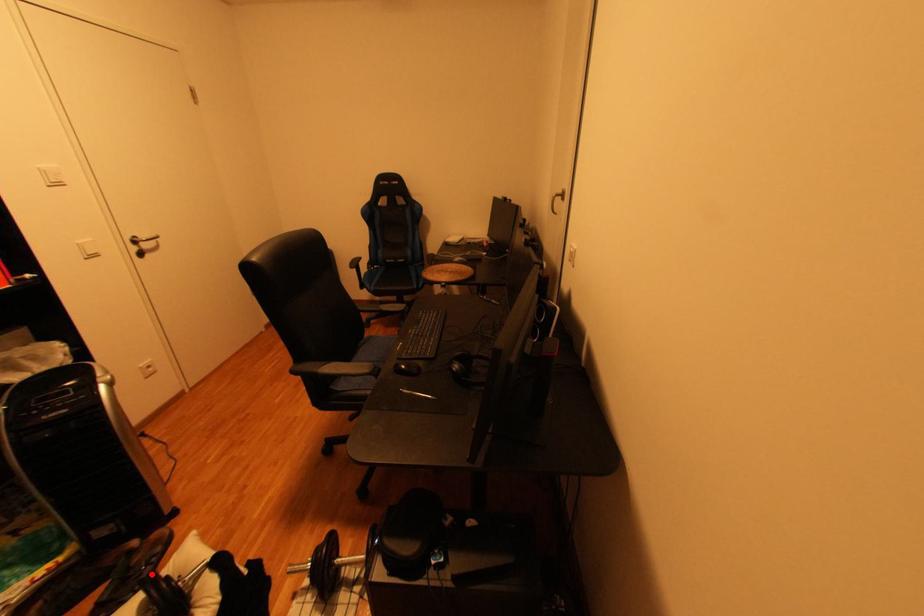
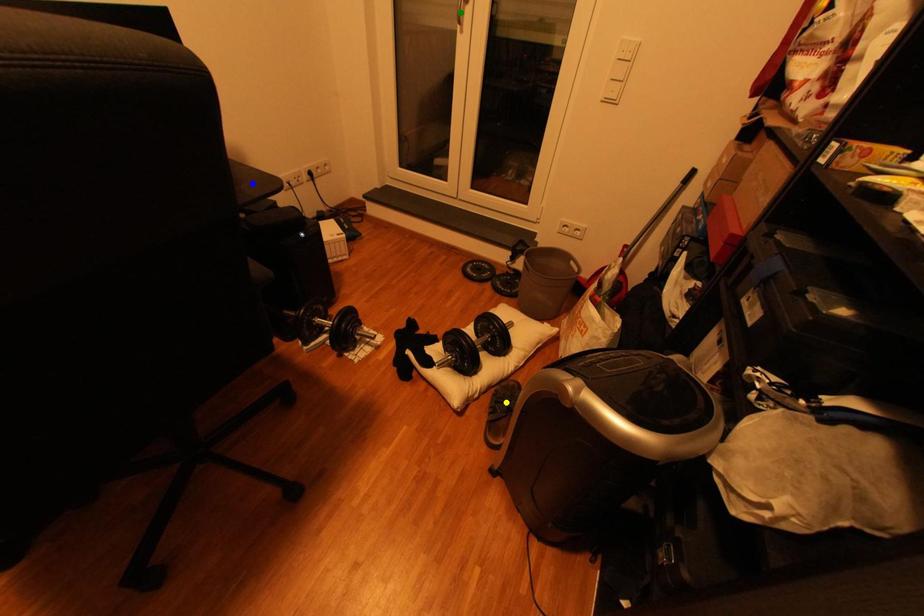
Question: I am providing you with two images of the same scene from different viewpoints. A red point is marked on the first image. You are given multiple points on the second image. Which mark in image 2 goes with the point in image 1?

Choices:
 (A) yellow point
 (B) blue point
 (C) green point

Answer: (A)